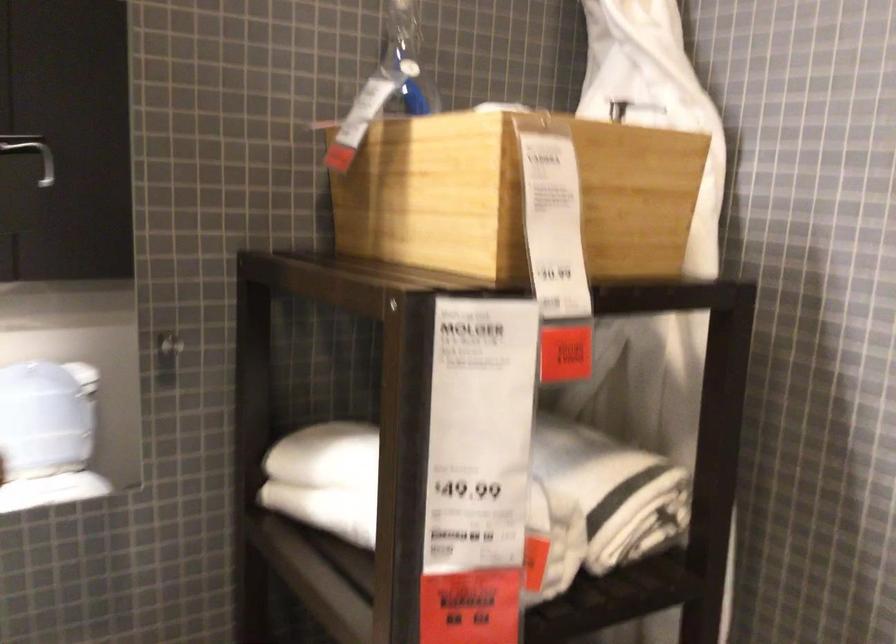
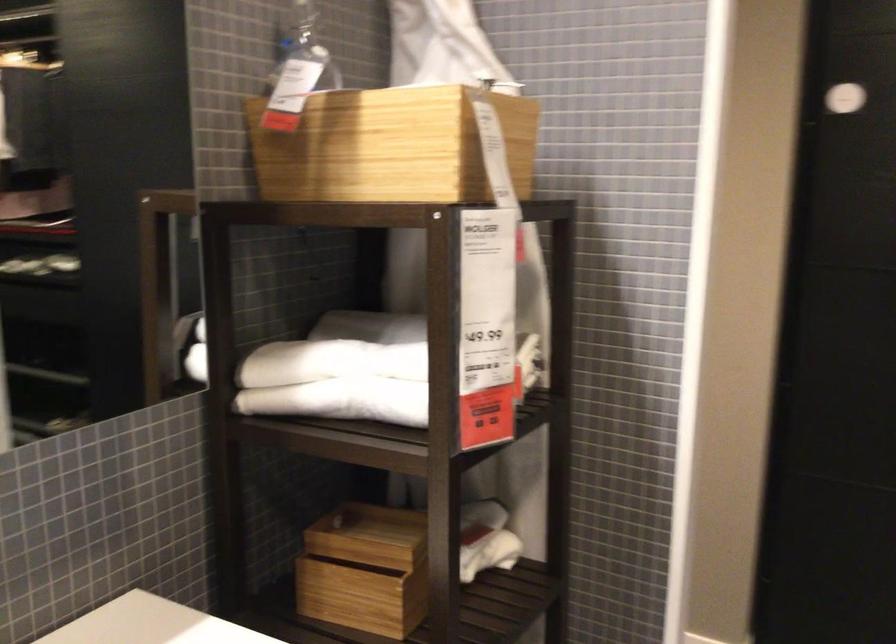
The point at (347, 468) is marked in the first image. Where is the corresponding point in the second image?

(330, 362)